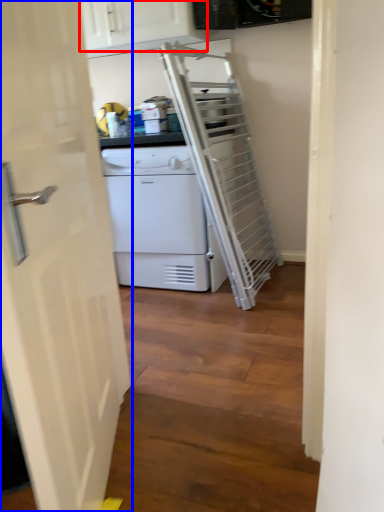
Question: Which of the following is the farthest to the observer, cabinetry (highlighted by a red box) or door (highlighted by a blue box)?

Choices:
 (A) cabinetry
 (B) door

Answer: (A)